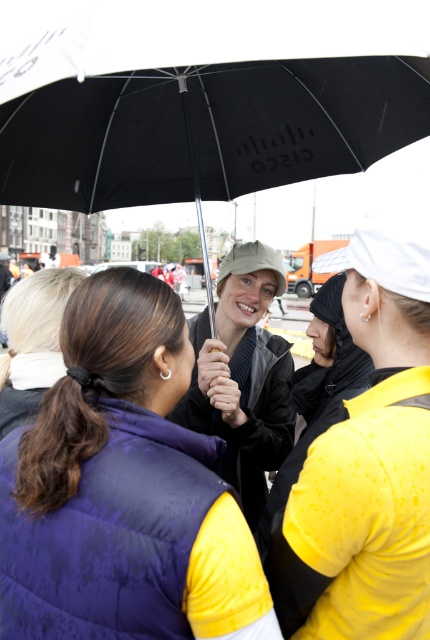
Question: Can you confirm if matte black umbrella at center is positioned above yellow matte vest at center?

Choices:
 (A) yes
 (B) no

Answer: (B)

Question: Which point is farther from the camera taking this photo?

Choices:
 (A) (150, 289)
 (B) (393, 225)
 (C) (254, 328)

Answer: (C)

Question: Which object is positioned farthest from the dark brown hair at center?

Choices:
 (A) yellow matte vest at center
 (B) matte black umbrella at center
 (C) matte black jacket at center
 (D) black matte umbrella at center

Answer: (A)

Question: Can you confirm if matte black umbrella at center is positioned below yellow matte vest at center?

Choices:
 (A) yes
 (B) no

Answer: (A)

Question: Among these points, which one is nearest to the camera?

Choices:
 (A) (297, 164)
 (B) (33, 360)
 (C) (199, 330)
 (D) (399, 444)

Answer: (D)

Question: Is black matte umbrella at center to the right of matte black jacket at center from the viewer's perspective?

Choices:
 (A) yes
 (B) no

Answer: (B)